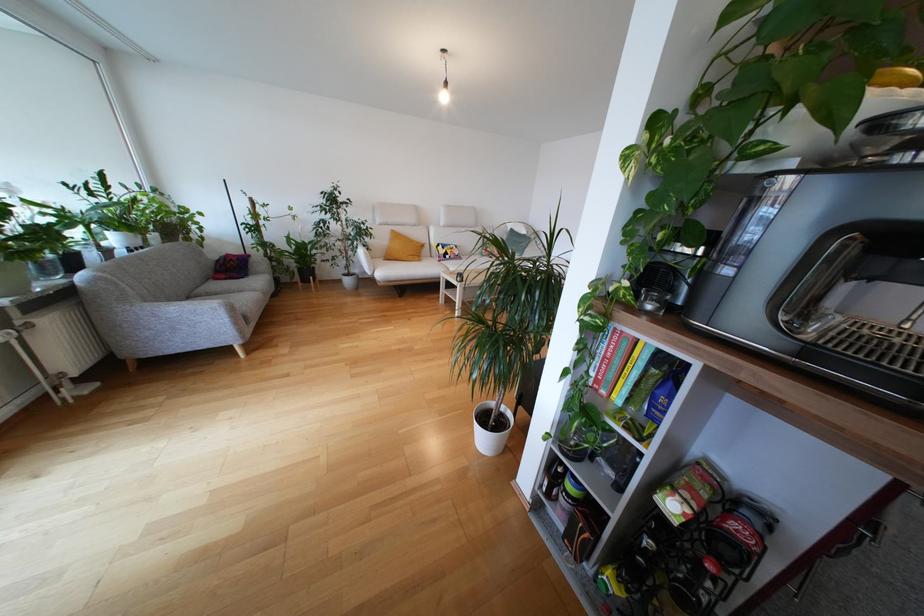
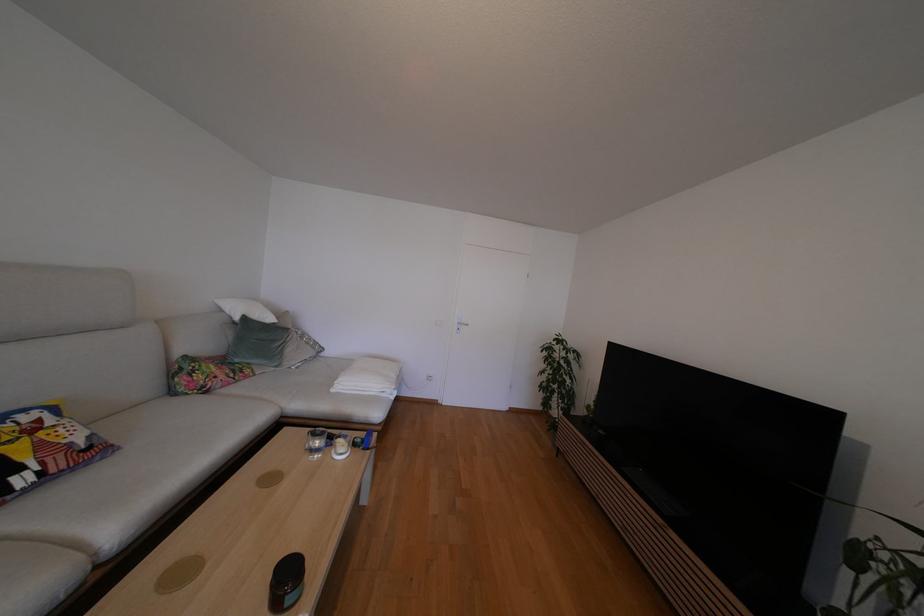
The point at (454, 246) is marked in the first image. Where is the corresponding point in the second image?

(6, 419)